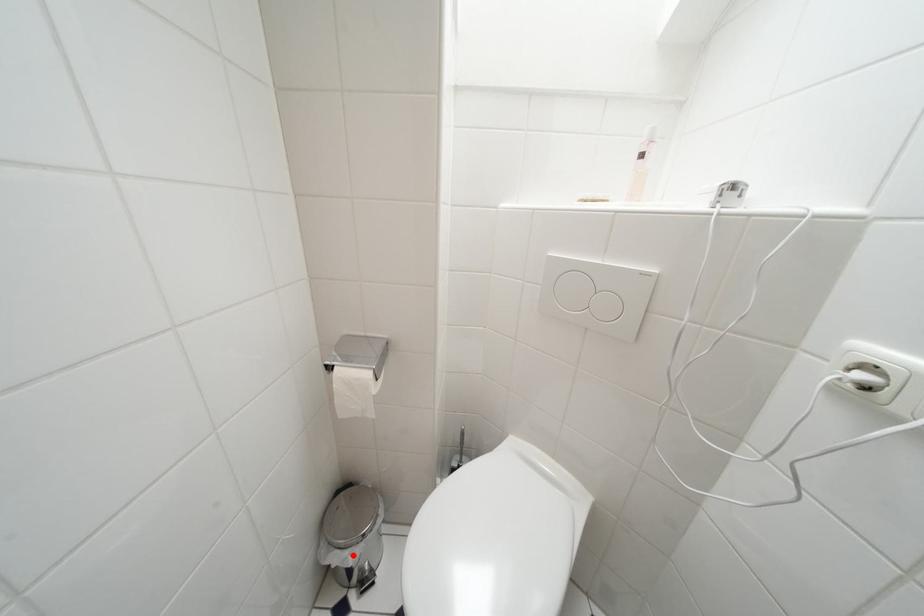
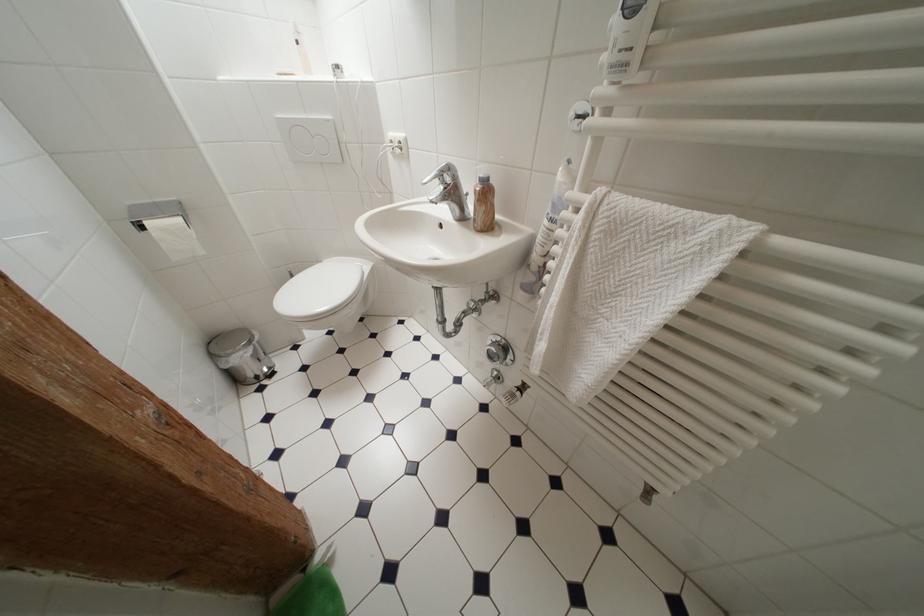
The point at the highlighted location is marked in the first image. Where is the corresponding point in the second image?

(249, 355)